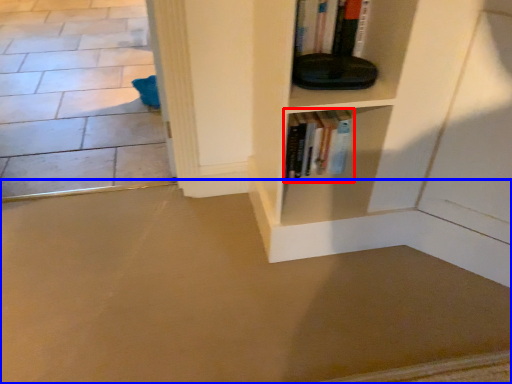
Question: Among these objects, which one is farthest to the camera, book (highlighted by a red box) or concrete (highlighted by a blue box)?

Choices:
 (A) book
 (B) concrete

Answer: (A)